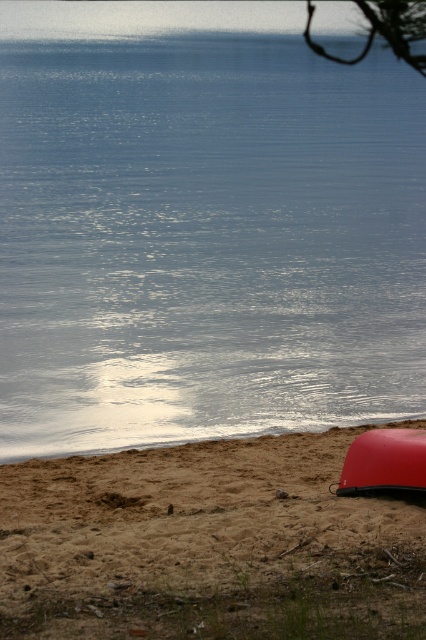
Question: Which object is positioned closest to the brown sandy beach at lower right?

Choices:
 (A) shiny red canoe at lower right
 (B) glistening blue water at lower center

Answer: (A)

Question: In this image, where is glistening blue water at lower center located relative to shiny red canoe at lower right?

Choices:
 (A) above
 (B) below

Answer: (A)

Question: Does glistening blue water at lower center have a larger size compared to shiny red canoe at lower right?

Choices:
 (A) no
 (B) yes

Answer: (B)

Question: Which of the following is the farthest from the observer?

Choices:
 (A) shiny red canoe at lower right
 (B) brown sandy beach at lower right

Answer: (B)

Question: Which of the following is the closest to the observer?

Choices:
 (A) brown sandy beach at lower right
 (B) shiny red canoe at lower right

Answer: (B)

Question: Is glistening blue water at lower center to the left of shiny red canoe at lower right from the viewer's perspective?

Choices:
 (A) no
 (B) yes

Answer: (B)